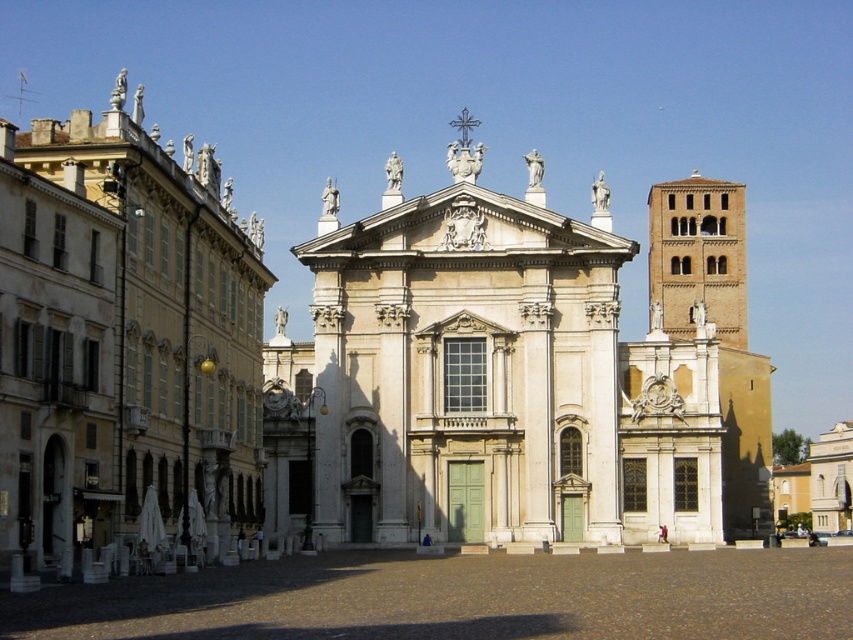
Question: In this image, where is beige stone church at center located relative to brown brick tower at upper right?

Choices:
 (A) below
 (B) above

Answer: (B)

Question: Is beige stone church at center to the right of brown brick tower at upper right from the viewer's perspective?

Choices:
 (A) yes
 (B) no

Answer: (B)

Question: Estimate the real-world distances between objects in this image. Which object is farther from the beige stone church at center?

Choices:
 (A) brown brick tower at upper right
 (B) beige stone church at left

Answer: (B)

Question: Which point is closer to the camera?

Choices:
 (A) beige stone church at left
 (B) brown brick tower at upper right

Answer: (A)

Question: Where is beige stone church at center located in relation to beige stone church at left in the image?

Choices:
 (A) right
 (B) left

Answer: (A)

Question: Which point appears farthest from the camera in this image?

Choices:
 (A) (96, 196)
 (B) (563, 506)

Answer: (B)